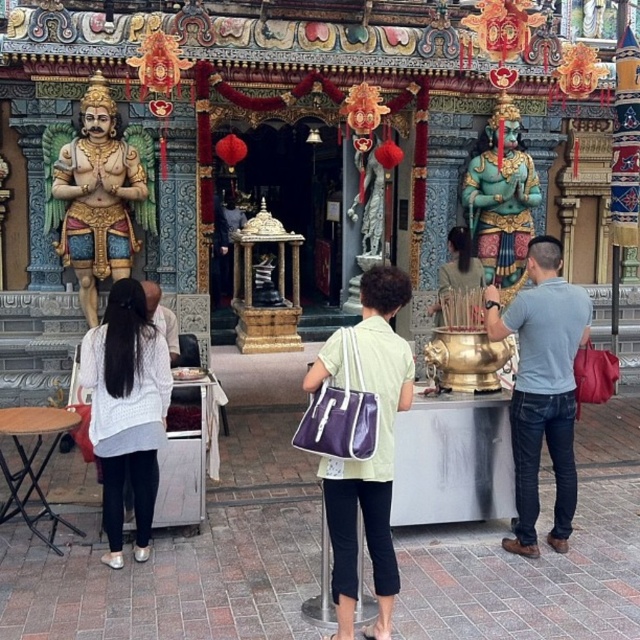
Question: Is gold polished statue at left positioned before white matte shirt at center?

Choices:
 (A) yes
 (B) no

Answer: (B)

Question: Observing the image, what is the correct spatial positioning of purple fabric bag at center in reference to white knitted sweater at left?

Choices:
 (A) left
 (B) right

Answer: (B)

Question: Which object is the farthest from the gold polished statue at left?

Choices:
 (A) green polished stone statue at right
 (B) white matte shirt at center

Answer: (A)

Question: Which point is farther from the camera taking this photo?

Choices:
 (A) coord(566,352)
 (B) coord(372,625)
 (C) coord(99,420)
 (D) coord(497,163)

Answer: (D)

Question: Which object appears farthest from the camera in this image?

Choices:
 (A) purple fabric bag at center
 (B) green polished stone statue at right

Answer: (B)

Question: Can you confirm if gold polished statue at left is positioned below green polished stone statue at right?

Choices:
 (A) no
 (B) yes

Answer: (B)